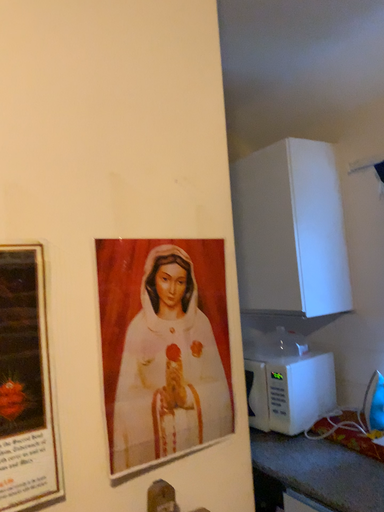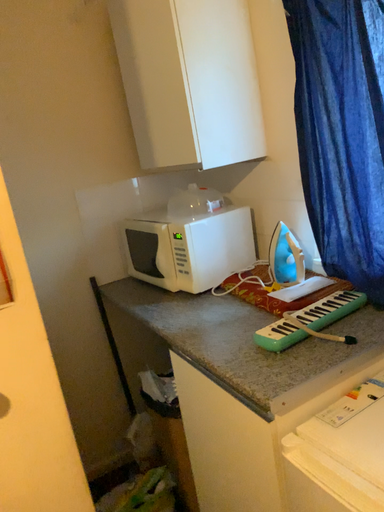
Question: Which way did the camera rotate in the video?

Choices:
 (A) rotated upward
 (B) rotated downward

Answer: (B)